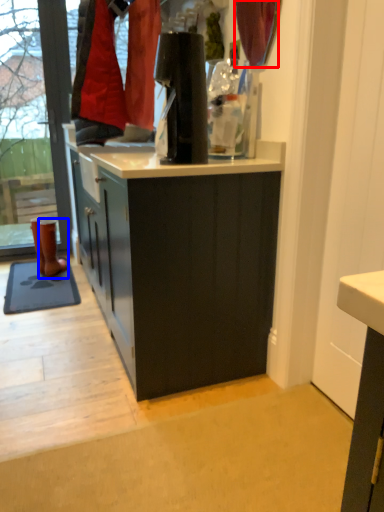
Question: Among these objects, which one is nearest to the camera, curtain (highlighted by a red box) or footwear (highlighted by a blue box)?

Choices:
 (A) curtain
 (B) footwear

Answer: (A)